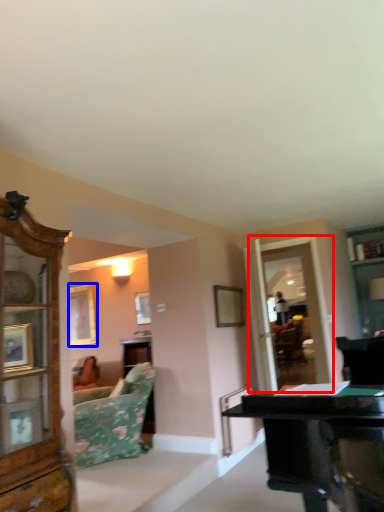
Question: Which object appears farthest to the camera in this image, glass door (highlighted by a red box) or picture frame (highlighted by a blue box)?

Choices:
 (A) glass door
 (B) picture frame

Answer: (B)